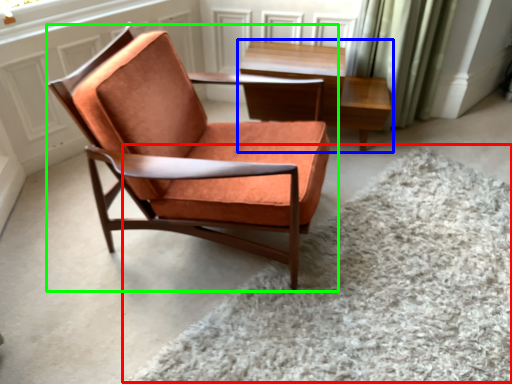
Question: Which is farther away from plain (highlighted by a red box)? table (highlighted by a blue box) or chair (highlighted by a green box)?

Choices:
 (A) table
 (B) chair

Answer: (A)